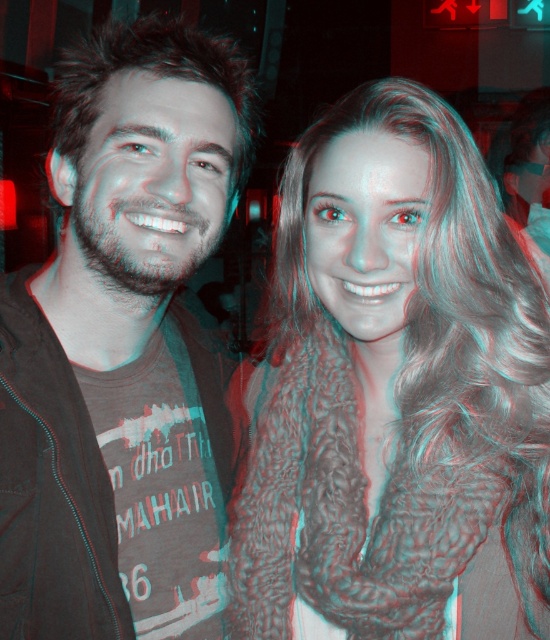
You are a photographer trying to capture a group photo of the man and the fuzzy brown scarf at center. The minimum distance required for your camera to focus clearly is 80 centimeters. Do you think you can take a clear photo of both subjects at the same time?

The subjects are 75.69 centimeters apart, which is less than the camera focus requirement of 80 centimeters. Therefore, the camera cannot focus clearly on both the man and the fuzzy brown scarf at center simultaneously.